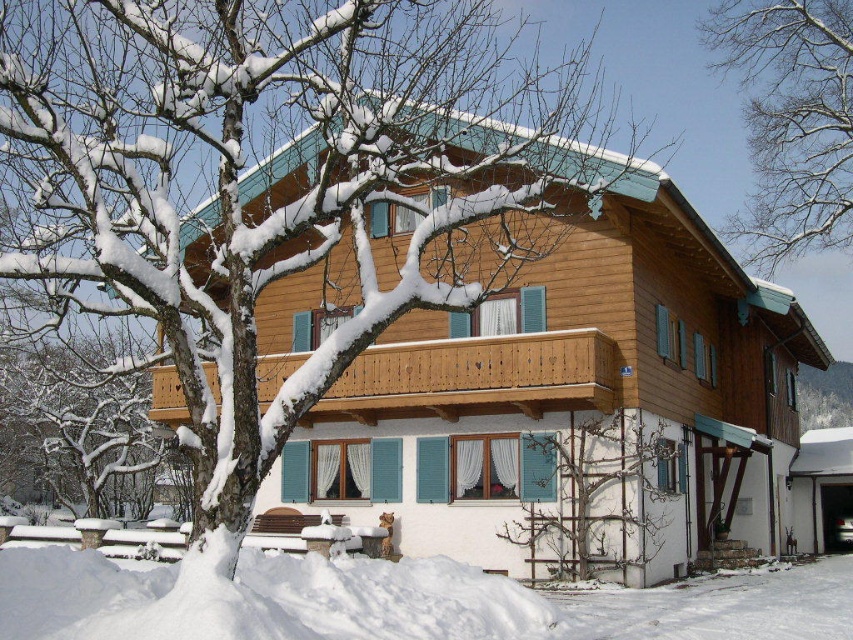
You are a delivery person trying to navigate to the house. You see the white fluffy snow at lower left and the bare branches at upper center. Which one is wider in the image?

The white fluffy snow at lower left is wider than the bare branches at upper center.